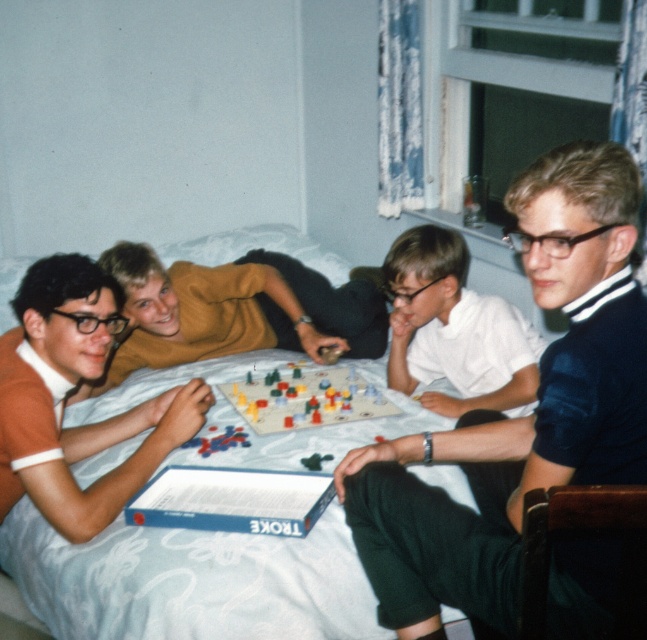
Who is shorter, dark blue jersey at center or matte yellow shirt at center?

With less height is matte yellow shirt at center.

The height and width of the screenshot is (640, 647). Describe the element at coordinates (520, 417) in the screenshot. I see `dark blue jersey at center` at that location.

Identify the location of dark blue jersey at center. The image size is (647, 640). (520, 417).

Can you confirm if white fabric bed at center is thinner than plastic colorful game pieces at center?

A: In fact, white fabric bed at center might be wider than plastic colorful game pieces at center.

Is point (17, 552) positioned before point (296, 408)?

Yes, it is in front of point (296, 408).

This screenshot has width=647, height=640. Describe the element at coordinates (190, 580) in the screenshot. I see `white fabric bed at center` at that location.

Identify the location of white fabric bed at center. click(190, 580).

Between matte yellow shirt at center and white matte shirt at center, which one is positioned lower?

white matte shirt at center is below.

Which is behind, point (250, 285) or point (417, 385)?

The point (250, 285) is behind.

Locate an element on the screen. matte yellow shirt at center is located at coordinates (232, 310).